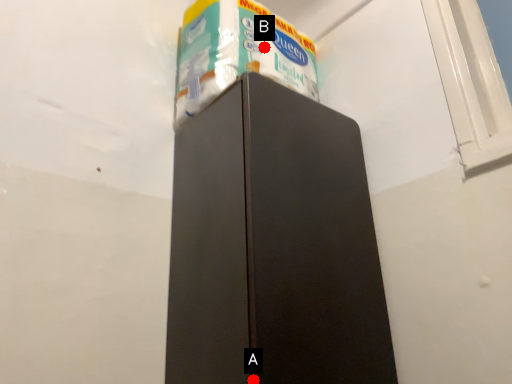
Question: Two points are circled on the image, labeled by A and B beside each circle. Among these points, which one is farthest from the camera?

Choices:
 (A) A is further
 (B) B is further

Answer: (B)